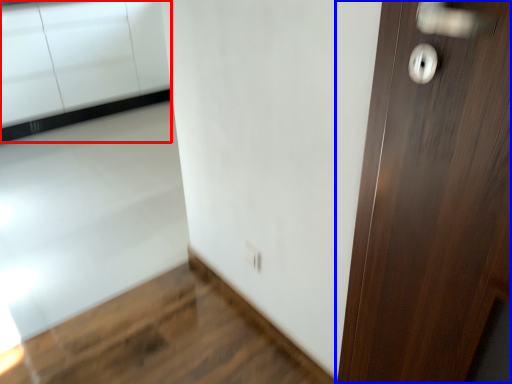
Question: Among these objects, which one is farthest to the camera, cabinetry (highlighted by a red box) or door (highlighted by a blue box)?

Choices:
 (A) cabinetry
 (B) door

Answer: (A)